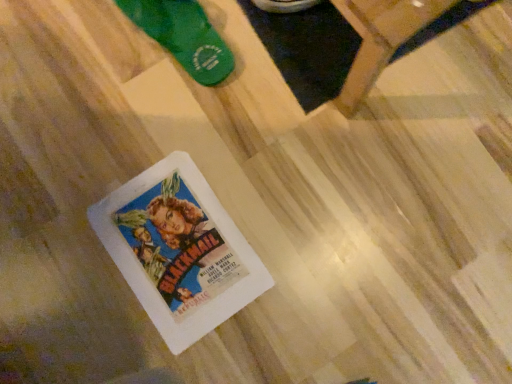
Identify the location of free space in front of green rubber slipper at upper center. (160, 118).